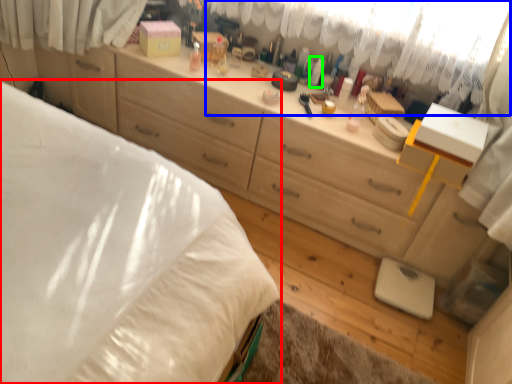
Question: Which object is the farthest from bed (highlighted by a red box)? Choose among these: curtain (highlighted by a blue box) or toiletry (highlighted by a green box).

Choices:
 (A) curtain
 (B) toiletry

Answer: (B)